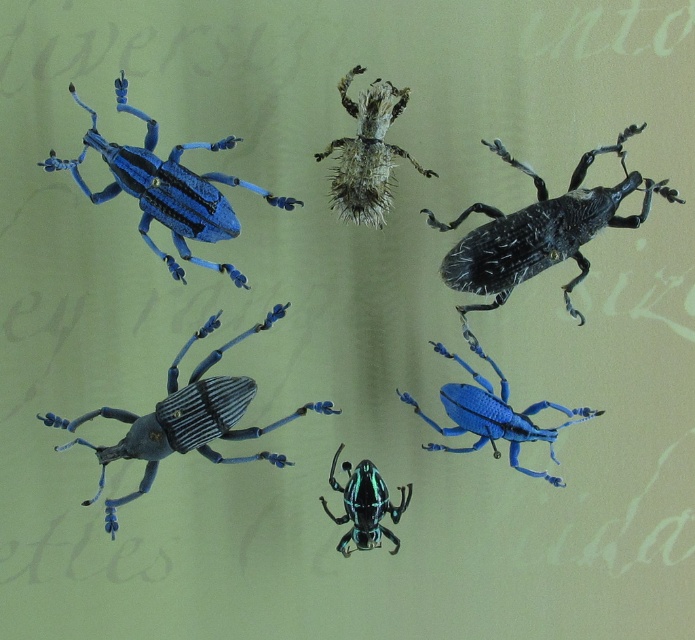
Question: Among these objects, which one is nearest to the camera?

Choices:
 (A) matte blue plastic beetle at upper left
 (B) fuzzy brown beetle at center

Answer: (A)

Question: Is shiny black beetle at upper right thinner than matte blue plastic beetle at upper left?

Choices:
 (A) yes
 (B) no

Answer: (B)

Question: Can you confirm if matte blue plastic beetle at upper left is smaller than matte blue beetle at lower right?

Choices:
 (A) yes
 (B) no

Answer: (B)

Question: Estimate the real-world distances between objects in this image. Which object is farther from the blue glossy beetle at center?

Choices:
 (A) matte blue beetle at lower right
 (B) shiny black beetle at upper right

Answer: (B)

Question: Which object is positioned closest to the shiny black beetle at upper right?

Choices:
 (A) blue glossy beetle at center
 (B) matte blue beetle at lower right

Answer: (B)

Question: Does fuzzy brown beetle at center come behind matte blue beetle at lower right?

Choices:
 (A) yes
 (B) no

Answer: (B)